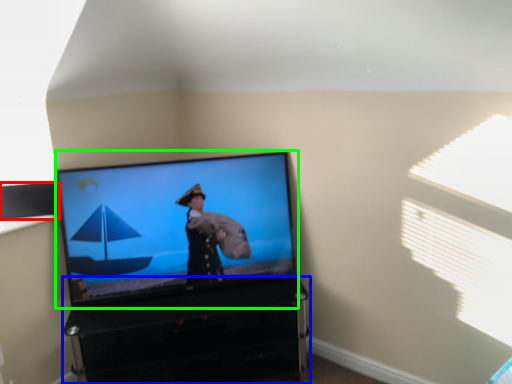
Question: Considering the real-world distances, which object is farthest from speaker (highlighted by a red box)? furniture (highlighted by a blue box) or television (highlighted by a green box)?

Choices:
 (A) furniture
 (B) television

Answer: (A)